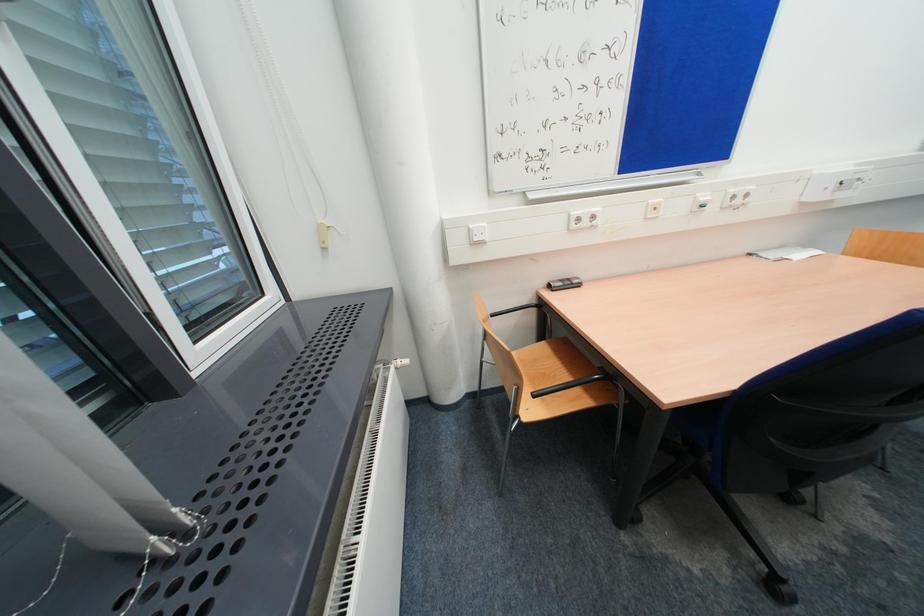
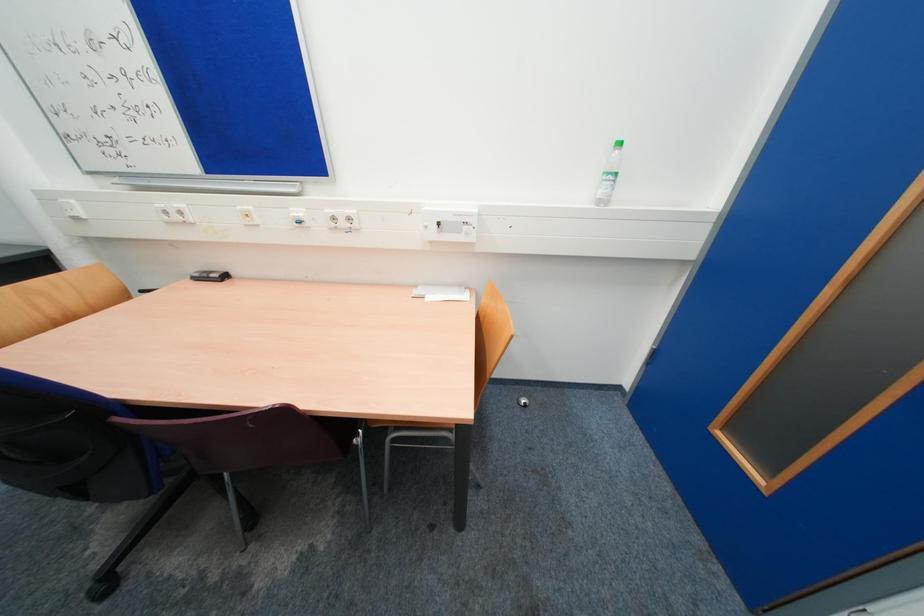
Question: Which direction would the cameraman need to move to produce the second image? Reply with the corresponding letter.

Choices:
 (A) Left
 (B) Right
 (C) Forward
 (D) Backward

Answer: (B)